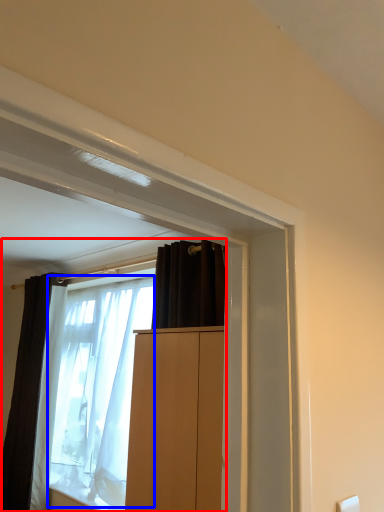
Question: Which of the following is the farthest to the observer, window (highlighted by a red box) or shower curtain (highlighted by a blue box)?

Choices:
 (A) window
 (B) shower curtain

Answer: (B)